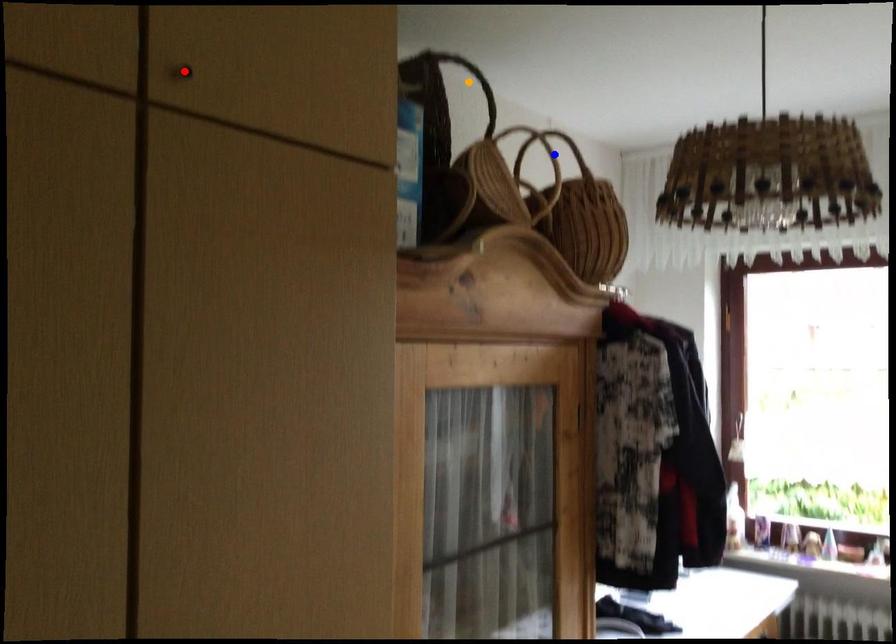
Order these from nearest to farthest:
red point | orange point | blue point

1. blue point
2. orange point
3. red point